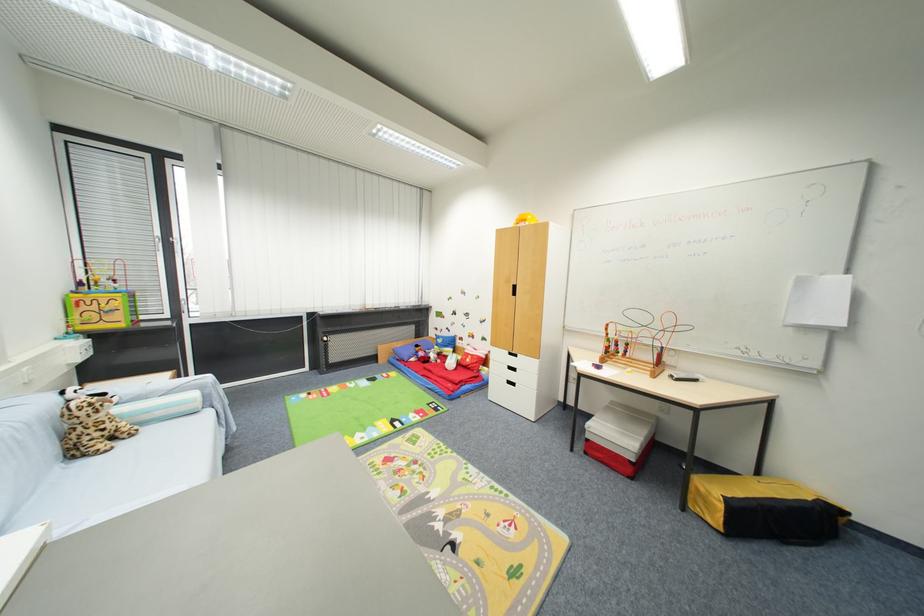
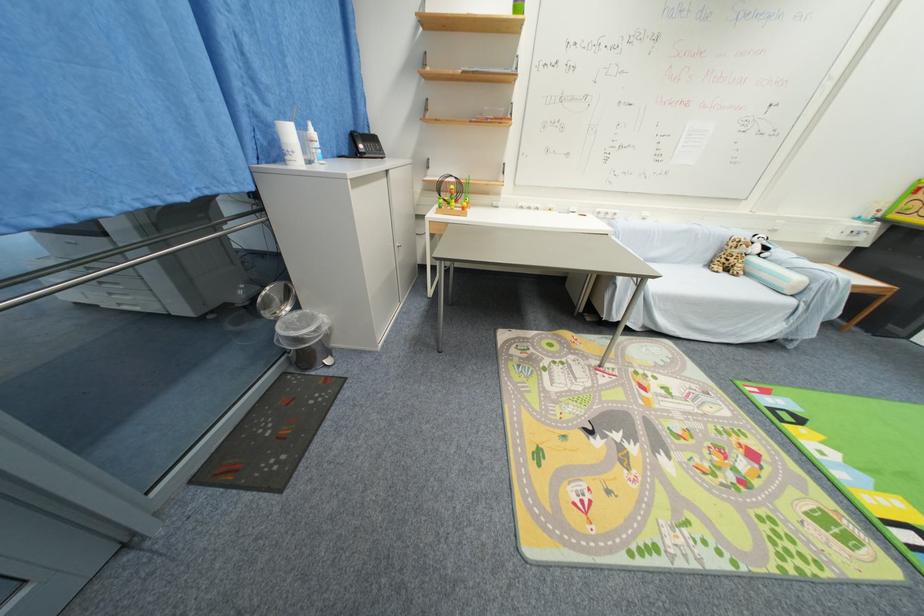
Where in the second image is the point corresponding to the point at 125,446 from the first image?

(730, 276)